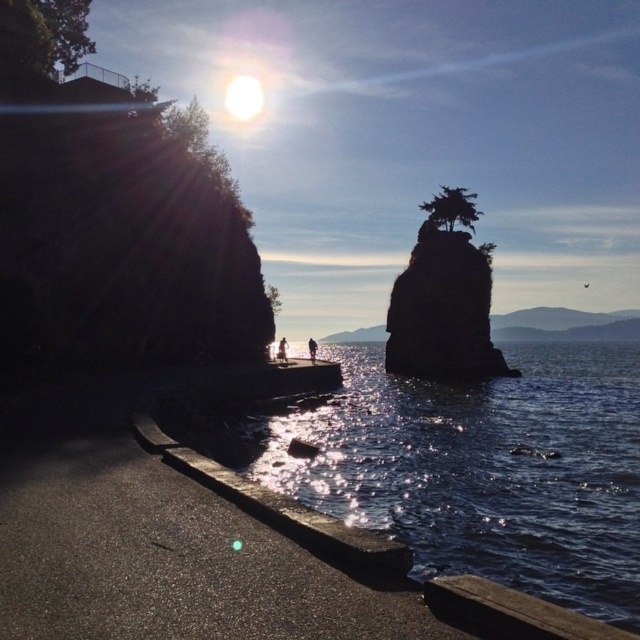
Question: Which object is positioned closest to the green leafy tree at upper left?

Choices:
 (A) silhouette figure at center
 (B) glistening water at lower center
 (C) silhouette stone at center

Answer: (A)

Question: Is silhouette stone at center closer to camera compared to green leafy tree at center?

Choices:
 (A) no
 (B) yes

Answer: (A)

Question: Does silhouette stone at center appear under green leafy tree at upper left?

Choices:
 (A) yes
 (B) no

Answer: (A)

Question: Which of these objects is positioned closest to the silhouette stone at center?

Choices:
 (A) glistening water at lower center
 (B) green leafy tree at upper left
 (C) light brown wooden stick at center
 (D) green leafy tree at center

Answer: (A)

Question: Is glistening water at lower center wider than silhouette stone at center?

Choices:
 (A) yes
 (B) no

Answer: (A)

Question: Which point appears closest to the camera in this image?

Choices:
 (A) [316, 344]
 (B) [29, 28]
 (C) [285, 342]
 (D) [509, 433]

Answer: (B)